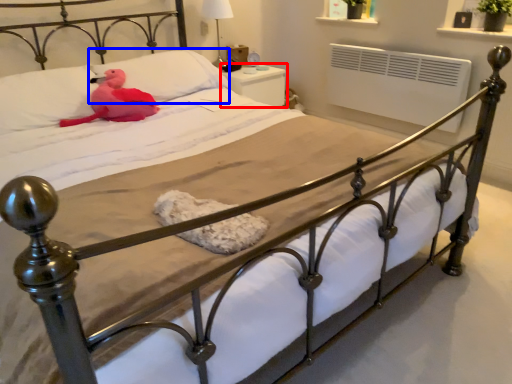
Question: Which point is closer to the camera, nightstand (highlighted by a red box) or pillow (highlighted by a blue box)?

Choices:
 (A) nightstand
 (B) pillow

Answer: (B)